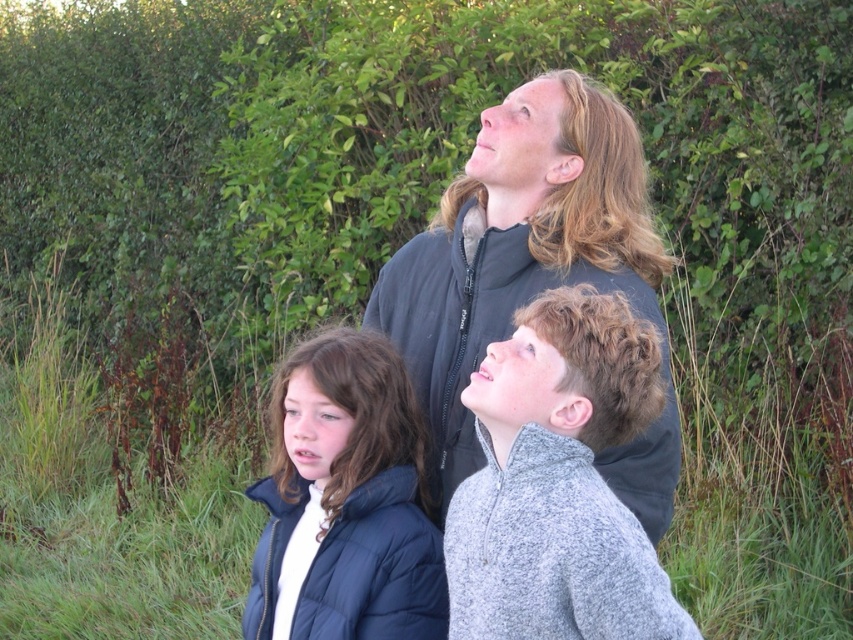
Does dark gray jacket at center appear under matte blue puffer jacket at lower left?

Incorrect, dark gray jacket at center is not positioned below matte blue puffer jacket at lower left.

Between dark gray jacket at center and matte blue puffer jacket at lower left, which one is positioned lower?

matte blue puffer jacket at lower left is below.

In order to click on dark gray jacket at center in this screenshot , I will do `click(531, 268)`.

At what (x,y) coordinates should I click in order to perform the action: click on dark gray jacket at center. Please return your answer as a coordinate pair (x, y). This screenshot has width=853, height=640. Looking at the image, I should click on (531, 268).

Does green grass at center have a lesser width compared to gray fleece jacket at center?

In fact, green grass at center might be wider than gray fleece jacket at center.

Looking at this image, who is taller, green grass at center or gray fleece jacket at center?

Standing taller between the two is green grass at center.

You are a GUI agent. You are given a task and a screenshot of the screen. Output one action in this format:
    pyautogui.click(x=<x>, y=<y>)
    Task: Click on the green grass at center
    The width and height of the screenshot is (853, 640).
    Given the screenshot: What is the action you would take?
    pyautogui.click(x=115, y=513)

Does gray fleece jacket at center appear under matte blue puffer jacket at lower left?

Incorrect, gray fleece jacket at center is not positioned below matte blue puffer jacket at lower left.

The height and width of the screenshot is (640, 853). What do you see at coordinates (558, 481) in the screenshot?
I see `gray fleece jacket at center` at bounding box center [558, 481].

You are a GUI agent. You are given a task and a screenshot of the screen. Output one action in this format:
    pyautogui.click(x=<x>, y=<y>)
    Task: Click on the gray fleece jacket at center
    Image resolution: width=853 pixels, height=640 pixels.
    Given the screenshot: What is the action you would take?
    pyautogui.click(x=558, y=481)